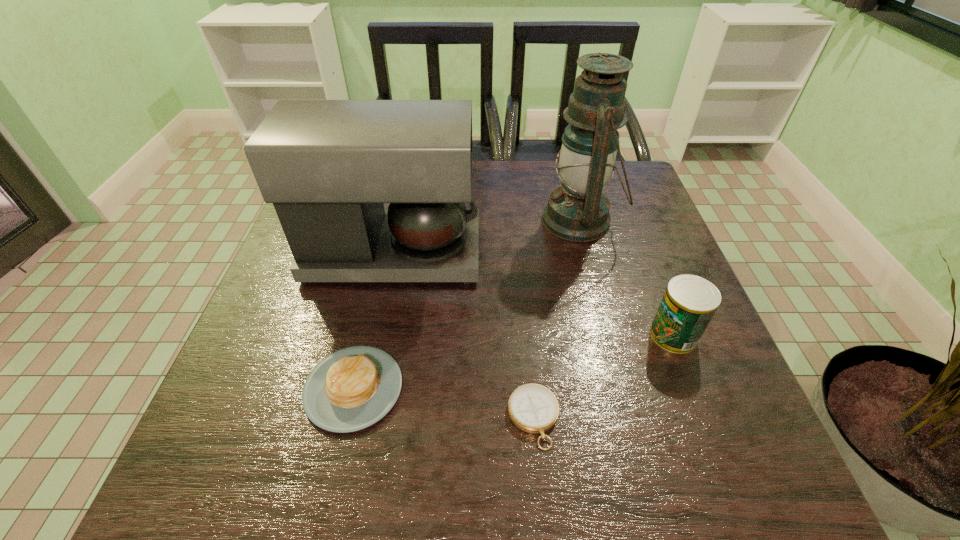
In the image, there is a desktop. Where is `vacant space at the right edge`? The width and height of the screenshot is (960, 540). vacant space at the right edge is located at coordinates (672, 377).

In the image, there is a desktop. Where is `vacant space at the far right corner`? Image resolution: width=960 pixels, height=540 pixels. vacant space at the far right corner is located at coordinates (613, 191).

At what (x,y) coordinates should I click in order to perform the action: click on free area in between the pancake and the compass. Please return your answer as a coordinate pair (x, y). Looking at the image, I should click on (444, 403).

This screenshot has width=960, height=540. In order to click on free space between the can and the tallest object in this screenshot , I will do `click(627, 278)`.

Locate an element on the screen. This screenshot has width=960, height=540. vacant space that's between the oil lamp and the third tallest object is located at coordinates (627, 278).

The width and height of the screenshot is (960, 540). Identify the location of free space between the third tallest object and the oil lamp. (627, 278).

The image size is (960, 540). In order to click on free spot between the compass and the tallest object in this screenshot , I will do `click(557, 319)`.

This screenshot has width=960, height=540. I want to click on empty space that is in between the third object from right to left and the can, so click(604, 376).

Image resolution: width=960 pixels, height=540 pixels. In order to click on vacant area that lies between the pancake and the shortest object in this screenshot , I will do `click(444, 403)`.

Image resolution: width=960 pixels, height=540 pixels. I want to click on free point between the third shortest object and the second tallest object, so click(533, 294).